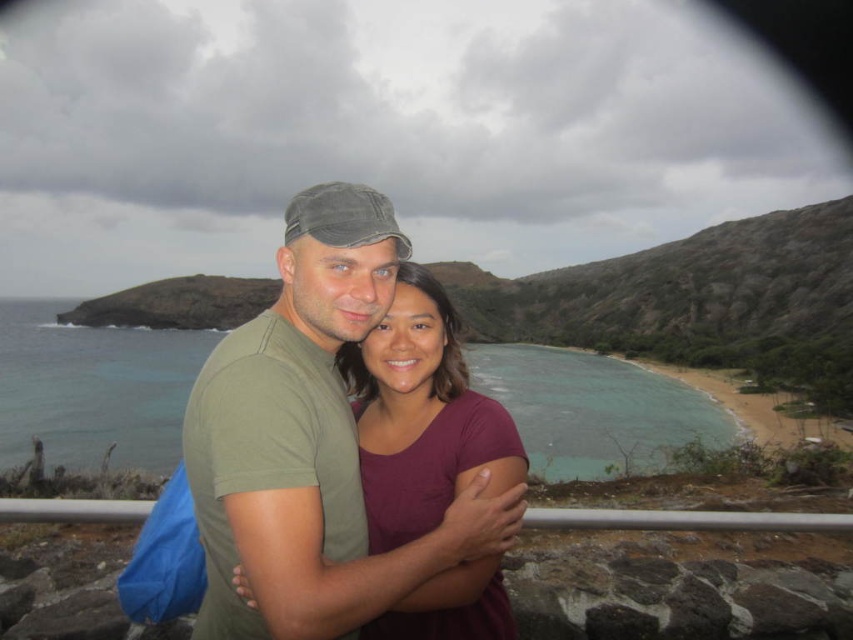
Question: Among these objects, which one is farthest from the camera?

Choices:
 (A) greenish-blue water at center
 (B) maroon fabric shirt at center
 (C) matte green t-shirt at center

Answer: (A)

Question: Among these objects, which one is nearest to the camera?

Choices:
 (A) greenish-blue water at center
 (B) matte green t-shirt at center

Answer: (B)

Question: Is matte green t-shirt at center thinner than maroon fabric shirt at center?

Choices:
 (A) yes
 (B) no

Answer: (B)

Question: Does matte green t-shirt at center appear under maroon fabric shirt at center?

Choices:
 (A) yes
 (B) no

Answer: (B)

Question: Does matte green t-shirt at center lie behind maroon fabric shirt at center?

Choices:
 (A) no
 (B) yes

Answer: (A)

Question: Which point appears farthest from the camera in this image?

Choices:
 (A) (320, 516)
 (B) (711, 413)
 (C) (368, 500)

Answer: (B)